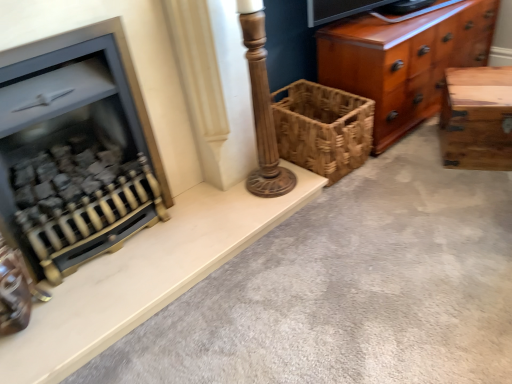
Image resolution: width=512 pixels, height=384 pixels. I want to click on vacant space in front of natural wood trunk at right, so click(478, 187).